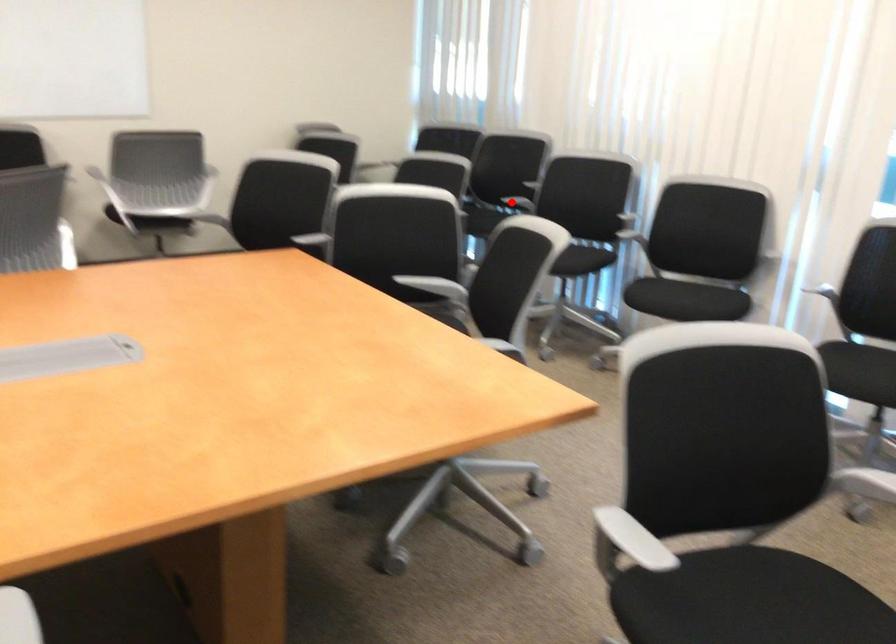
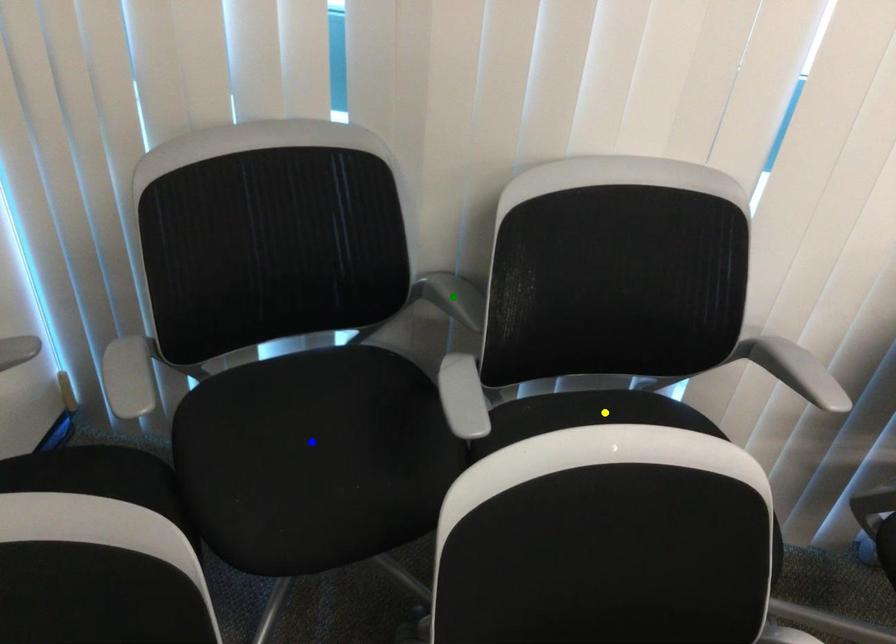
Question: I am providing you with two images of the same scene from different viewpoints. A red point is marked on the first image. You are given multiple points on the second image. Which point in image 2 represents the same 3d spot as the red point in image 1?

Choices:
 (A) green point
 (B) blue point
 (C) yellow point

Answer: (C)